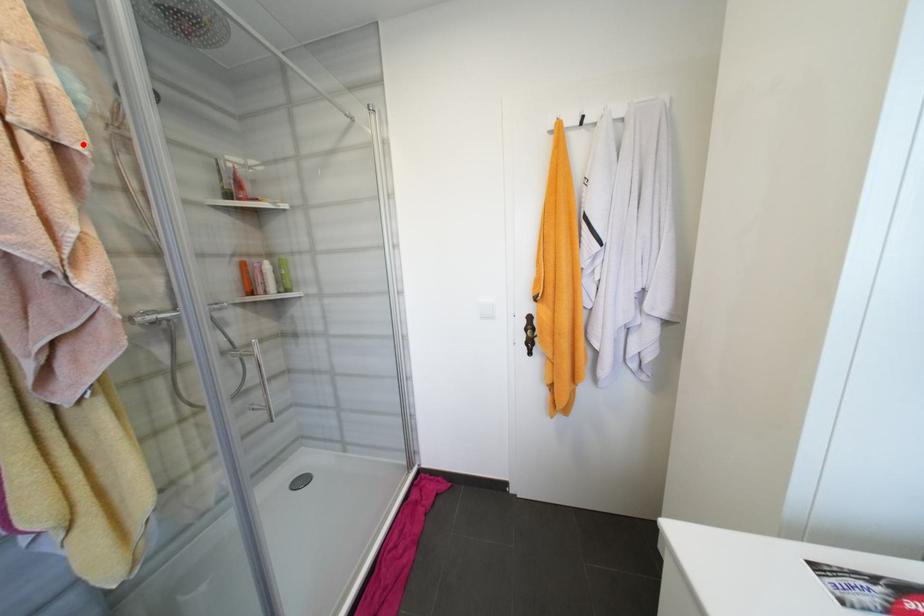
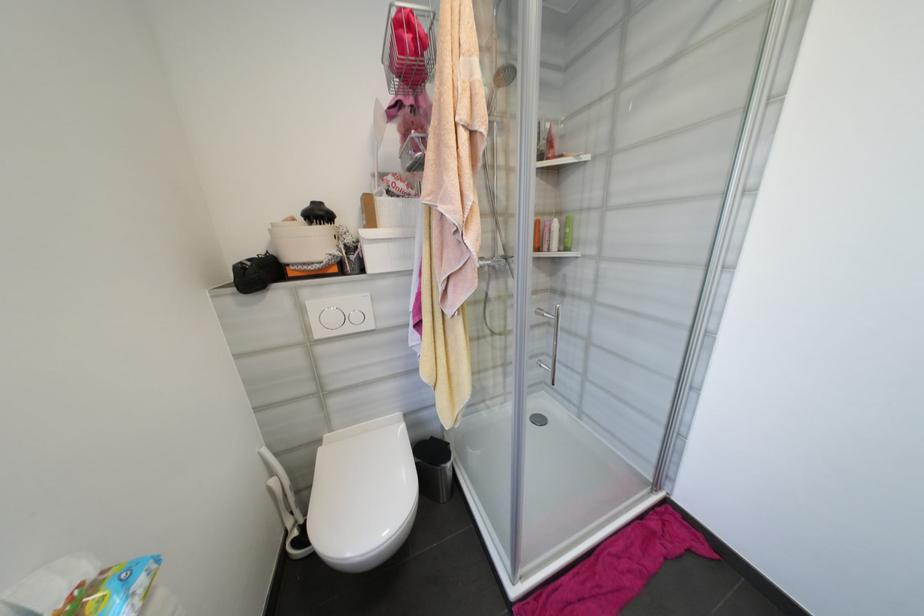
In the second image, find the point that corresponds to the highlighted location in the first image.

(488, 127)